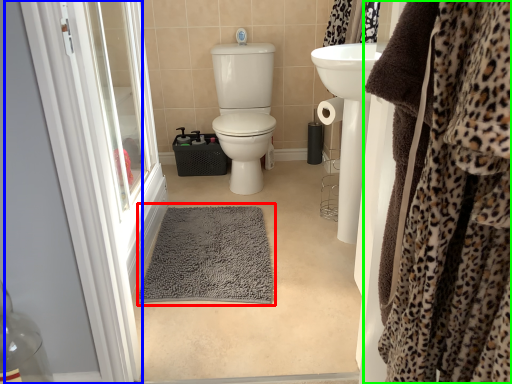
Question: Estimate the real-world distances between objects in this image. Which object is closer to bath mat (highlighted by a red box), screen door (highlighted by a blue box) or clothing (highlighted by a green box)?

Choices:
 (A) screen door
 (B) clothing

Answer: (A)